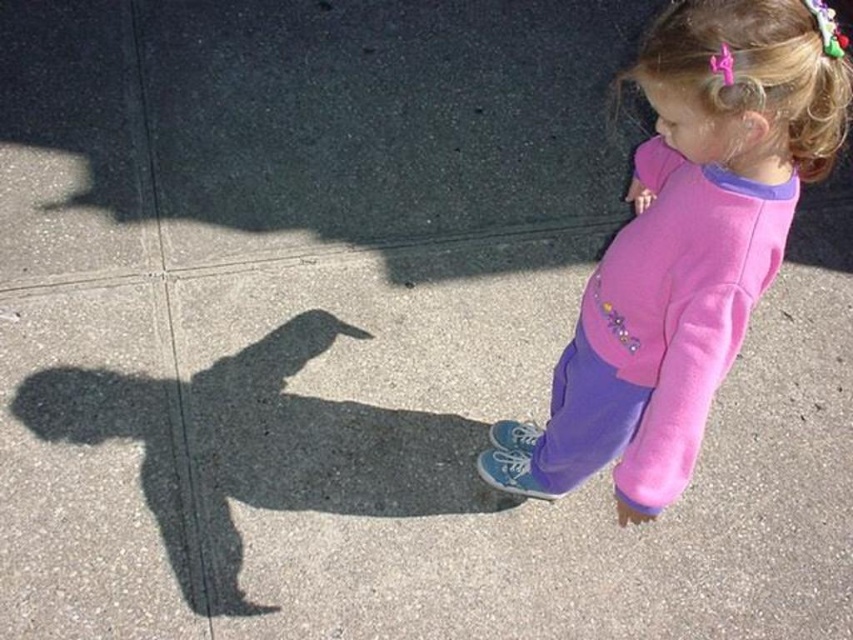
Consider the image. You are a photographer trying to capture the child in the image. You want to position your camera so that both the pink fleece sweatshirt at center and the pink hair clip at upper right are visible in the frame. Based on their positions, which object should you focus on first to ensure both are in the shot?

The pink fleece sweatshirt at center is to the left of the pink hair clip at upper right, so you should focus on the pink fleece sweatshirt at center first to ensure both are in the frame.

The child is wearing a pink fleece sweatshirt at center and has a pink hair clip at upper right. Which item is wider?

The pink fleece sweatshirt at center is wider than the pink hair clip at upper right.

You are a photographer trying to capture the child in the image. You want to ensure both the pink fleece sweatshirt at center and the pink hair clip at upper right are clearly visible in your photo. Based on their positions, which object is easier to focus on and why?

The pink fleece sweatshirt at center is much taller than the pink hair clip at upper right, so it is easier to focus on because larger objects are generally easier to capture clearly in a photograph.